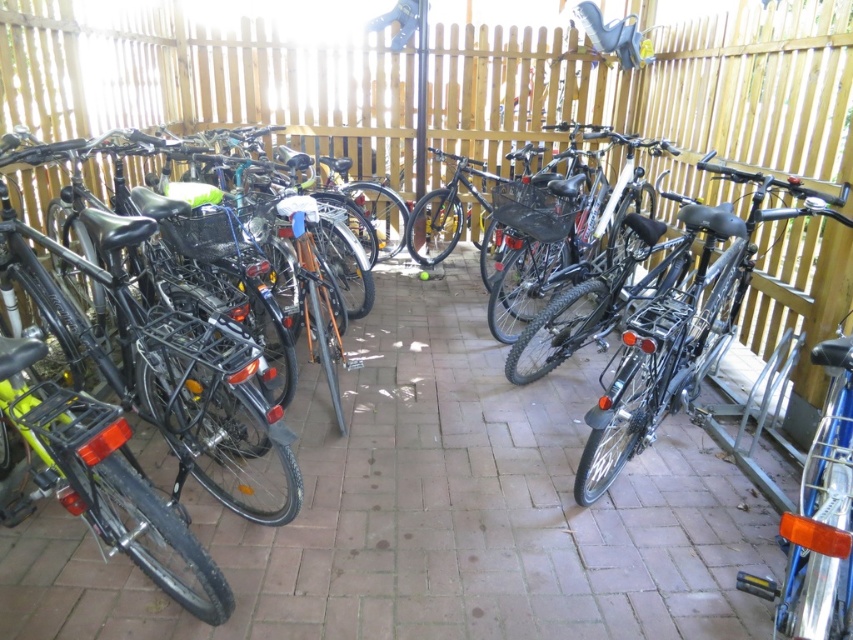
Does point (268, 461) come farther from viewer compared to point (701, 339)?

Yes, point (268, 461) is farther from viewer.

Is point (224, 605) closer to camera compared to point (700, 342)?

That is True.

Where is `matte black bicycle at left`? This screenshot has height=640, width=853. matte black bicycle at left is located at coordinates (161, 365).

Can you confirm if matte black bicycle at left is taller than shiny silver bicycle at right?

Correct, matte black bicycle at left is much taller as shiny silver bicycle at right.

Which is more to the right, matte black bicycle at left or shiny silver bicycle at right?

From the viewer's perspective, shiny silver bicycle at right appears more on the right side.

This screenshot has width=853, height=640. What do you see at coordinates (161, 365) in the screenshot?
I see `matte black bicycle at left` at bounding box center [161, 365].

At what (x,y) coordinates should I click in order to perform the action: click on matte black bicycle at left. Please return your answer as a coordinate pair (x, y). The width and height of the screenshot is (853, 640). Looking at the image, I should click on (x=161, y=365).

Can you confirm if shiny black bicycle at right is positioned above shiny silver bicycle at right?

Correct, shiny black bicycle at right is located above shiny silver bicycle at right.

Is shiny black bicycle at right behind shiny silver bicycle at right?

Yes, shiny black bicycle at right is behind shiny silver bicycle at right.

Find the location of a particular element. The height and width of the screenshot is (640, 853). shiny black bicycle at right is located at coordinates (683, 326).